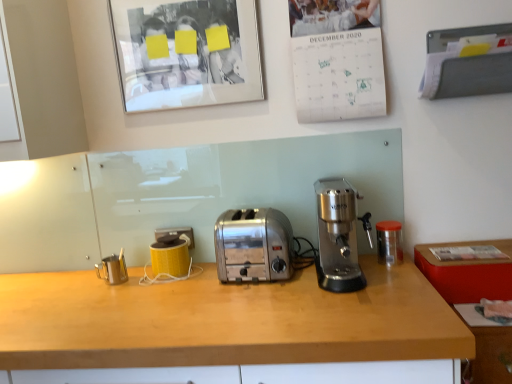
Question: From a real-world perspective, is transparent plastic container at right, which ranks as the 3th appliance in left-to-right order, located beneath satin chrome toaster at center?

Choices:
 (A) no
 (B) yes

Answer: (B)

Question: Does transparent plastic container at right, arranged as the 1th appliance when viewed from the right, touch satin chrome toaster at center?

Choices:
 (A) no
 (B) yes

Answer: (A)

Question: Can you confirm if transparent plastic container at right, arranged as the 1th appliance when viewed from the right, is shorter than satin chrome toaster at center?

Choices:
 (A) no
 (B) yes

Answer: (B)

Question: From a real-world perspective, is transparent plastic container at right, arranged as the 1th appliance when viewed from the right, physically above satin chrome toaster at center?

Choices:
 (A) no
 (B) yes

Answer: (A)

Question: Is transparent plastic container at right, arranged as the 1th appliance when viewed from the right, to the left of satin chrome toaster at center from the viewer's perspective?

Choices:
 (A) yes
 (B) no

Answer: (B)

Question: In the image, is matte glass picture frame at upper left positioned in front of or behind yellow plastic electric outlet at lower left?

Choices:
 (A) front
 (B) behind

Answer: (A)

Question: From the image's perspective, is matte glass picture frame at upper left located above or below yellow plastic electric outlet at lower left?

Choices:
 (A) below
 (B) above

Answer: (B)

Question: Looking at their shapes, would you say matte glass picture frame at upper left is wider or thinner than yellow plastic electric outlet at lower left?

Choices:
 (A) thin
 (B) wide

Answer: (B)

Question: Is matte glass picture frame at upper left to the left or to the right of yellow plastic electric outlet at lower left in the image?

Choices:
 (A) right
 (B) left

Answer: (A)

Question: In the image, is transparent plastic container at right, which ranks as the 3th appliance in left-to-right order, positioned in front of or behind wooden countertop at lower right?

Choices:
 (A) front
 (B) behind

Answer: (B)

Question: Based on their sizes in the image, would you say transparent plastic container at right, arranged as the 1th appliance when viewed from the right, is bigger or smaller than wooden countertop at lower right?

Choices:
 (A) small
 (B) big

Answer: (A)

Question: Considering the relative positions of transparent plastic container at right, which ranks as the 3th appliance in left-to-right order, and wooden countertop at lower right in the image provided, is transparent plastic container at right, which ranks as the 3th appliance in left-to-right order, to the left or to the right of wooden countertop at lower right?

Choices:
 (A) left
 (B) right

Answer: (A)

Question: Does point (379, 233) appear closer or farther from the camera than point (479, 322)?

Choices:
 (A) closer
 (B) farther

Answer: (B)

Question: Is yellow plastic electric outlet at lower left inside the boundaries of brushed metal milk frother at left, the third appliance positioned from the right, or outside?

Choices:
 (A) inside
 (B) outside

Answer: (B)

Question: From a real-world perspective, relative to brushed metal milk frother at left, which appears as the first appliance when viewed from the left, is yellow plastic electric outlet at lower left vertically above or below?

Choices:
 (A) above
 (B) below

Answer: (A)